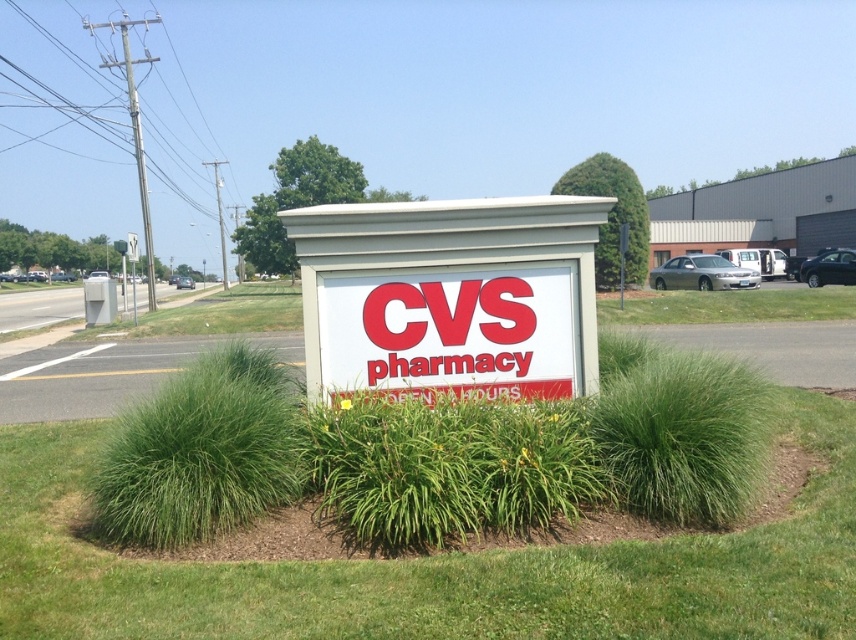
Question: Does green leafy grass at center have a larger size compared to white plastic cvs pharmacy sign at center?

Choices:
 (A) yes
 (B) no

Answer: (B)

Question: Among these objects, which one is farthest from the camera?

Choices:
 (A) white plastic cvs pharmacy sign at center
 (B) green leafy grass at center

Answer: (A)

Question: Which of the following is the farthest from the observer?

Choices:
 (A) (458, 332)
 (B) (795, 566)

Answer: (A)

Question: Is the position of green leafy grass at center more distant than that of white plastic cvs pharmacy sign at center?

Choices:
 (A) no
 (B) yes

Answer: (A)

Question: Can you confirm if green leafy grass at center is positioned above white plastic cvs pharmacy sign at center?

Choices:
 (A) yes
 (B) no

Answer: (B)